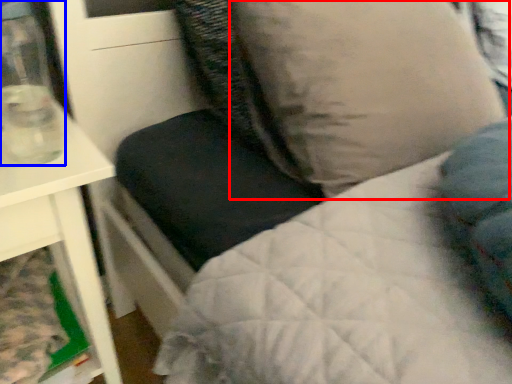
Question: Which of the following is the closest to the observer, pillow (highlighted by a red box) or glass vase (highlighted by a blue box)?

Choices:
 (A) pillow
 (B) glass vase

Answer: (B)